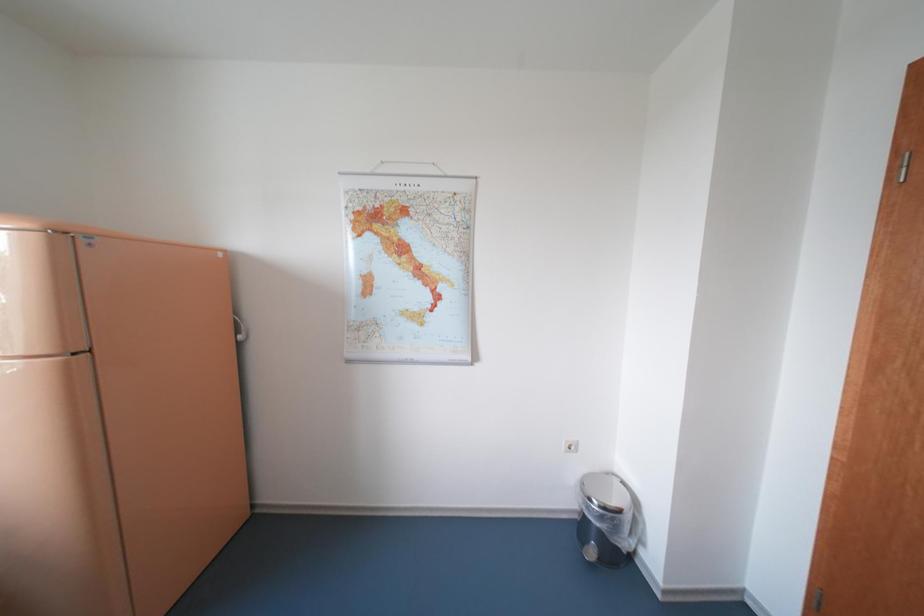
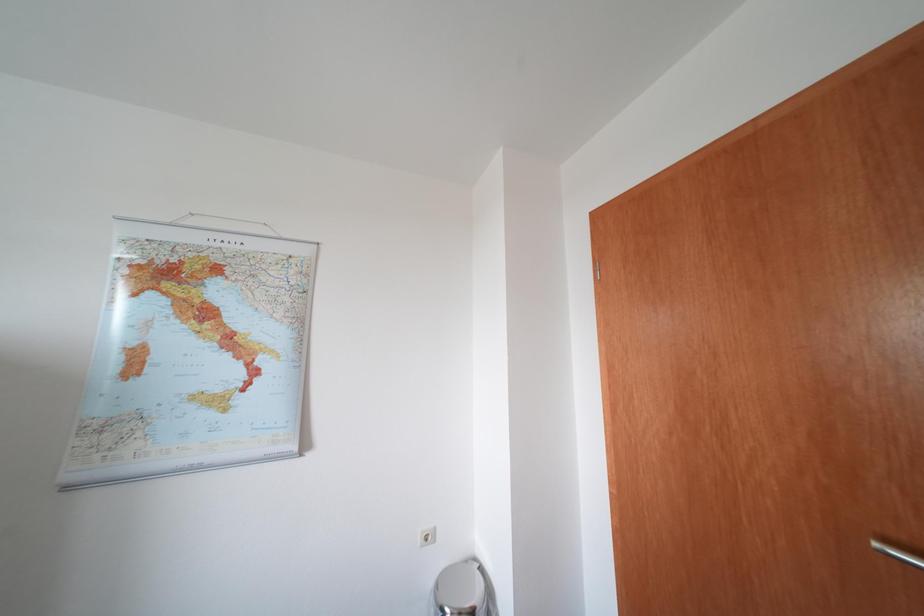
Question: The images are taken continuously from a first-person perspective. In which direction is your viewpoint rotating?

Choices:
 (A) Left
 (B) Right
 (C) Up
 (D) Down

Answer: (B)